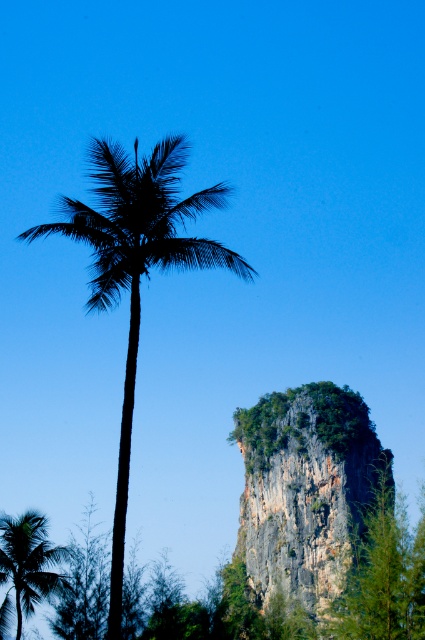
You are standing in the tropical landscape and want to take a photo of both point (x=266, y=422) and point (x=136, y=342). Which point should you focus on first to ensure both are in sharp focus?

You should focus on point (x=136, y=342) first because it is closer to you than point (x=266, y=422), which is further away. By focusing on the closer point, the depth of field may help keep both in focus.

You are a hiker trying to locate the rocky cliff at center in this tropical landscape. According to the coordinates provided, where would you find it?

The rocky cliff at center is located at point [306,490].